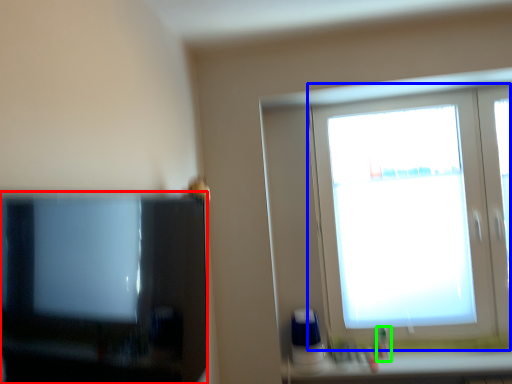
Question: Estimate the real-world distances between objects in this image. Which object is farther from television (highlighted by a red box), window (highlighted by a blue box) or toiletry (highlighted by a green box)?

Choices:
 (A) window
 (B) toiletry

Answer: (B)